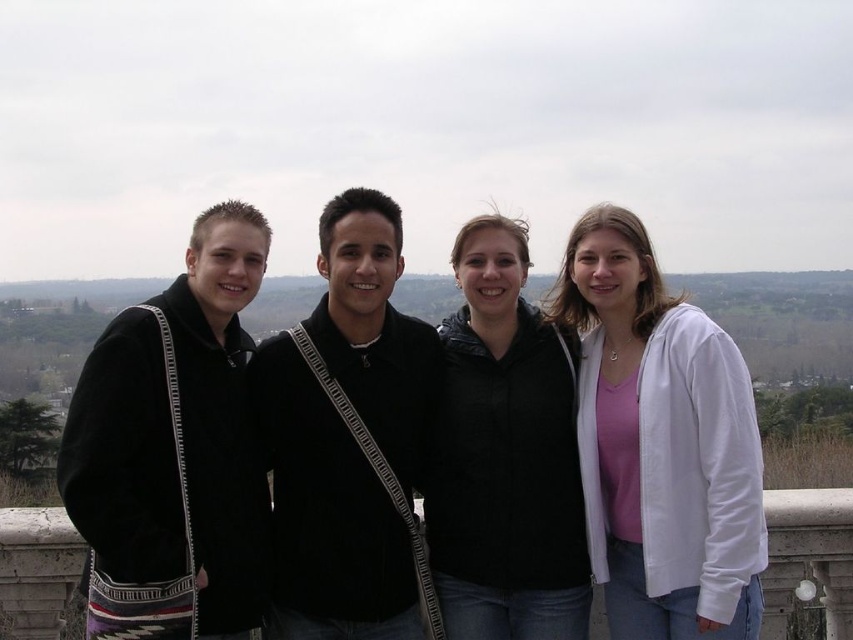
Consider the image. Between white cotton jacket at right and black jacket at center, which one appears on the right side from the viewer's perspective?

Positioned to the right is white cotton jacket at right.

Where is `white cotton jacket at right`? Image resolution: width=853 pixels, height=640 pixels. white cotton jacket at right is located at coordinates (660, 444).

This screenshot has width=853, height=640. What are the coordinates of `white cotton jacket at right` in the screenshot? It's located at (660, 444).

Identify the location of white cotton jacket at right. [660, 444].